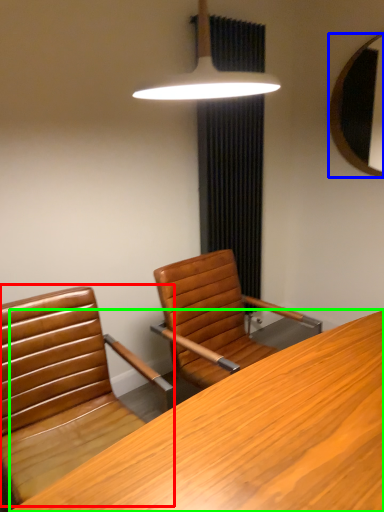
Question: Based on their relative distances, which object is farther from chair (highlighted by a red box)? Choose from mirror (highlighted by a blue box) and desk (highlighted by a green box).

Choices:
 (A) mirror
 (B) desk

Answer: (A)